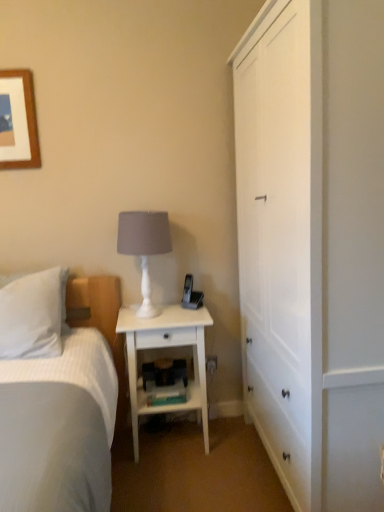
Question: Is white plastic electric outlet at lower center in front of or behind white matte table lamp at center in the image?

Choices:
 (A) front
 (B) behind

Answer: (B)

Question: From the image's perspective, is white plastic electric outlet at lower center above or below white matte table lamp at center?

Choices:
 (A) above
 (B) below

Answer: (B)

Question: Estimate the real-world distances between objects in this image. Which object is closer to the white matte table lamp at center?

Choices:
 (A) white wood nightstand at center
 (B) white plastic electric outlet at lower center
 (C) white wood cabinet at right
 (D) white soft pillow at left

Answer: (A)

Question: Which object is positioned farthest from the white matte table lamp at center?

Choices:
 (A) white plastic electric outlet at lower center
 (B) white wood nightstand at center
 (C) white soft pillow at left
 (D) white wood cabinet at right

Answer: (D)